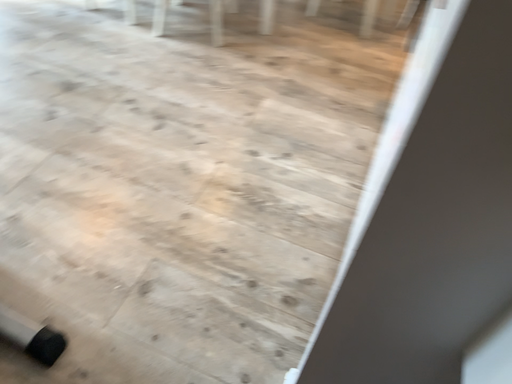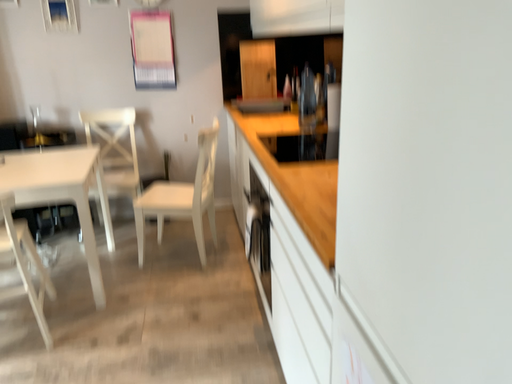
Question: How did the camera likely rotate when shooting the video?

Choices:
 (A) rotated left
 (B) rotated right

Answer: (B)